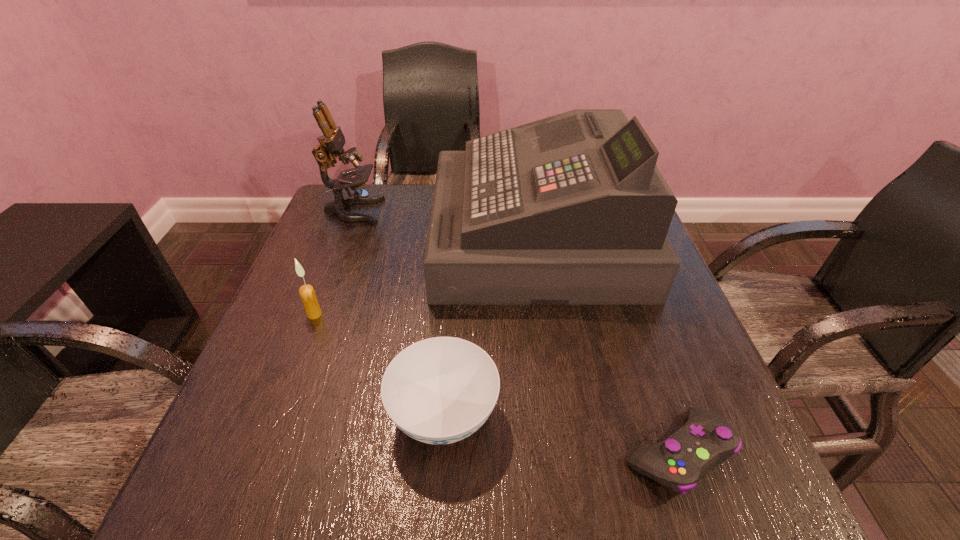
This screenshot has height=540, width=960. Identify the location of free space between the microscope and the control. (515, 332).

The image size is (960, 540). In order to click on empty space that is in between the third farthest object and the microscope in this screenshot , I will do `click(334, 263)`.

The width and height of the screenshot is (960, 540). I want to click on free space between the fourth tallest object and the third tallest object, so click(379, 364).

Locate an element on the screen. blank region between the chinaware and the cash register is located at coordinates (490, 326).

I want to click on empty space between the control and the cash register, so click(x=606, y=345).

The height and width of the screenshot is (540, 960). I want to click on vacant space in between the second shortest object and the microscope, so click(x=398, y=313).

What are the coordinates of `free spot between the cash register and the shortest object` in the screenshot? It's located at (606, 345).

Identify the location of the closest object relative to the chinaware. The image size is (960, 540). (571, 209).

Find the location of a particular element. This screenshot has height=540, width=960. object that stands as the second closest to the third tallest object is located at coordinates (571, 209).

The image size is (960, 540). In order to click on free location that satisfies the following two spatial constraints: 1. at the eyepieces of the microscope; 2. on the right side of the candle in this screenshot , I will do `click(314, 314)`.